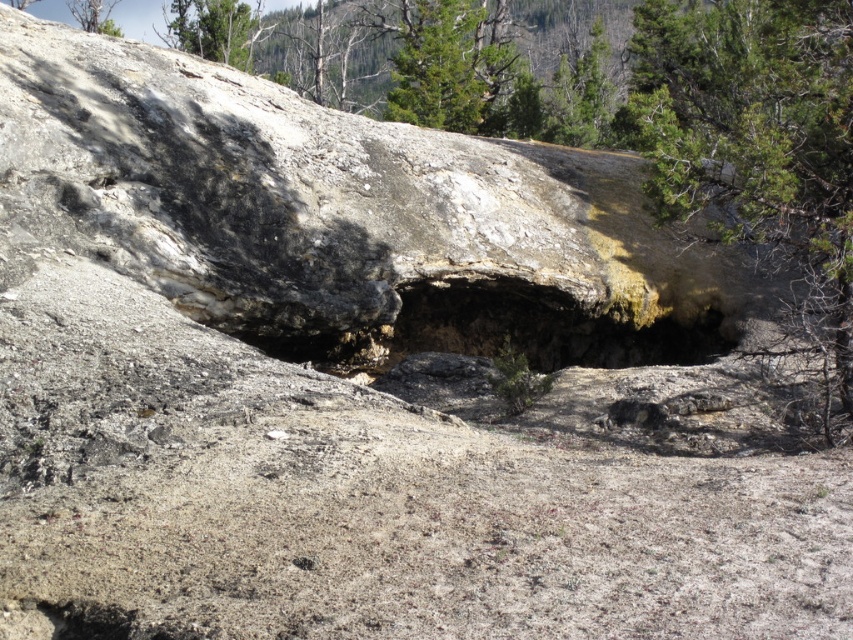
Question: Which of the following is the closest to the observer?

Choices:
 (A) green textured tree at upper center
 (B) dark rock cave at center

Answer: (B)

Question: Can you confirm if green leafy tree at right is positioned to the left of green textured tree at upper center?

Choices:
 (A) yes
 (B) no

Answer: (B)

Question: Does green leafy tree at right appear over dark rock cave at center?

Choices:
 (A) no
 (B) yes

Answer: (B)

Question: Is dark rock cave at center to the right of green textured tree at upper center from the viewer's perspective?

Choices:
 (A) yes
 (B) no

Answer: (A)

Question: Which point appears closest to the camera in this image?

Choices:
 (A) pos(399,35)
 (B) pos(851,157)
 (C) pos(666,333)

Answer: (B)

Question: Which point is farther to the camera?

Choices:
 (A) (840, 387)
 (B) (474, 6)

Answer: (B)